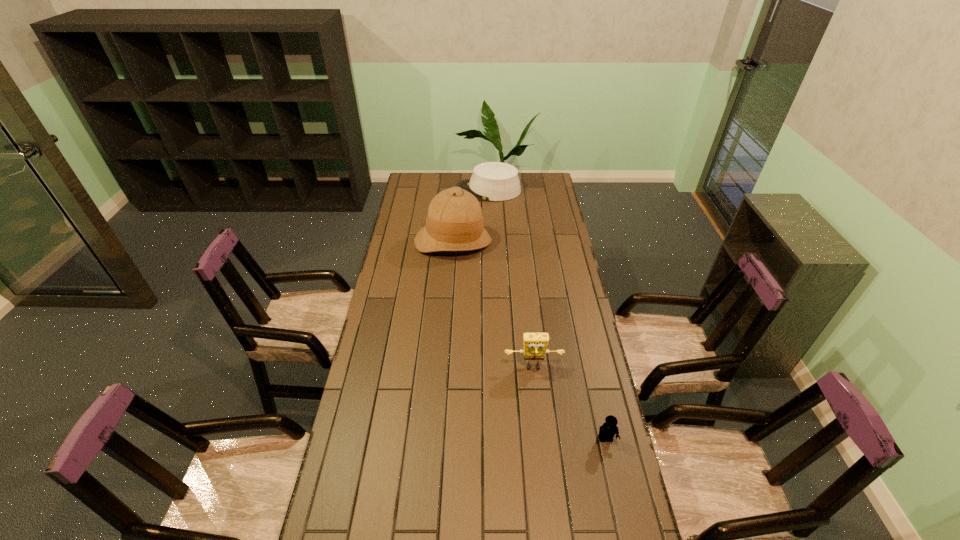
You are a GUI agent. You are given a task and a screenshot of the screen. Output one action in this format:
    pyautogui.click(x=<x>, y=<y>)
    Task: Click on the vacant space located on the front-facing side of the shorter hat
    This screenshot has height=540, width=960.
    Given the screenshot: What is the action you would take?
    click(x=422, y=190)

You are a GUI agent. You are given a task and a screenshot of the screen. Output one action in this format:
    pyautogui.click(x=<x>, y=<y>)
    Task: Click on the free space located 0.140m on the front-facing side of the shorter hat
    This screenshot has width=960, height=540.
    Given the screenshot: What is the action you would take?
    pyautogui.click(x=430, y=190)

Where is `free space located on the front-facing side of the shorter hat`? This screenshot has height=540, width=960. free space located on the front-facing side of the shorter hat is located at coordinates (411, 190).

Find the location of a particular element. vacant space located on the front-facing side of the rightmost object is located at coordinates (623, 519).

Find the location of `object at the far edge`. object at the far edge is located at coordinates (492, 181).

Find the location of `object at the left edge`. object at the left edge is located at coordinates (454, 222).

The height and width of the screenshot is (540, 960). In order to click on sponge present at the right edge in this screenshot , I will do `click(535, 344)`.

At what (x,y) coordinates should I click in order to perform the action: click on Lego that is at the right edge. Please return your answer as a coordinate pair (x, y). The width and height of the screenshot is (960, 540). Looking at the image, I should click on (607, 431).

I want to click on free point at the far edge, so click(x=522, y=188).

Where is `vacant space at the left edge of the desktop`? vacant space at the left edge of the desktop is located at coordinates (363, 377).